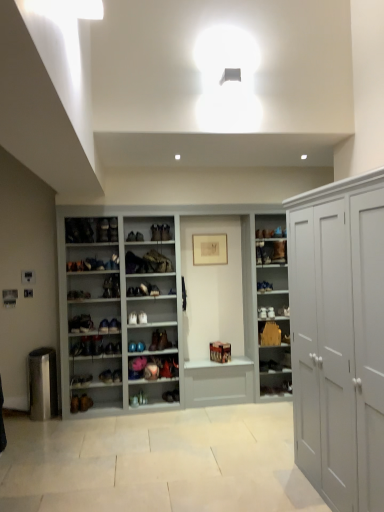
At what (x,y) coordinates should I click in order to perform the action: click on vacant area that lies in front of shiny brown leather shoe at center, the first shoe in the bottom-to-top sequence. Please return your answer as a coordinate pair (x, y). Looking at the image, I should click on coord(172,406).